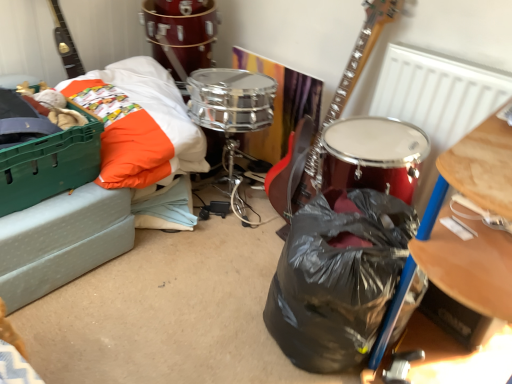
Question: Is black plastic bag at center at the left side of green plastic crate at left?

Choices:
 (A) no
 (B) yes

Answer: (A)

Question: Can you confirm if black plastic bag at center is wider than green plastic crate at left?

Choices:
 (A) no
 (B) yes

Answer: (A)

Question: Would you say black plastic bag at center is outside green plastic crate at left?

Choices:
 (A) no
 (B) yes

Answer: (B)

Question: From the image's perspective, would you say black plastic bag at center is shown under green plastic crate at left?

Choices:
 (A) yes
 (B) no

Answer: (A)

Question: From the image's perspective, is black plastic bag at center on green plastic crate at left?

Choices:
 (A) yes
 (B) no

Answer: (B)

Question: Is black plastic bag at center positioned with its back to green plastic crate at left?

Choices:
 (A) yes
 (B) no

Answer: (B)

Question: From a real-world perspective, is black plastic bag at center positioned under shiny metallic drum at upper center based on gravity?

Choices:
 (A) no
 (B) yes

Answer: (B)

Question: Is black plastic bag at center bigger than shiny metallic drum at upper center?

Choices:
 (A) no
 (B) yes

Answer: (A)

Question: From a real-world perspective, is black plastic bag at center over shiny metallic drum at upper center?

Choices:
 (A) no
 (B) yes

Answer: (A)

Question: Can you confirm if black plastic bag at center is positioned to the left of shiny metallic drum at upper center?

Choices:
 (A) yes
 (B) no

Answer: (B)

Question: Would you consider black plastic bag at center to be distant from shiny metallic drum at upper center?

Choices:
 (A) yes
 (B) no

Answer: (A)

Question: Is black plastic bag at center not within shiny metallic drum at upper center?

Choices:
 (A) no
 (B) yes

Answer: (B)

Question: Is shiny metallic drum at upper center shorter than black plastic bag at center?

Choices:
 (A) no
 (B) yes

Answer: (B)